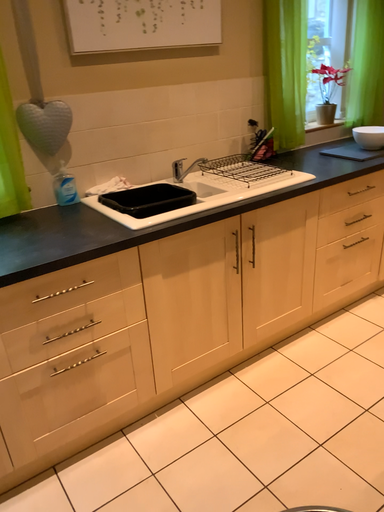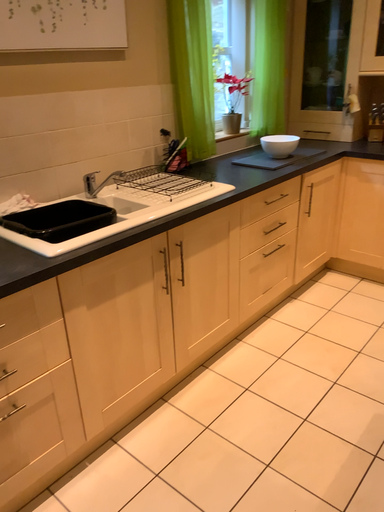
Question: How did the camera likely rotate when shooting the video?

Choices:
 (A) rotated left
 (B) rotated right

Answer: (B)